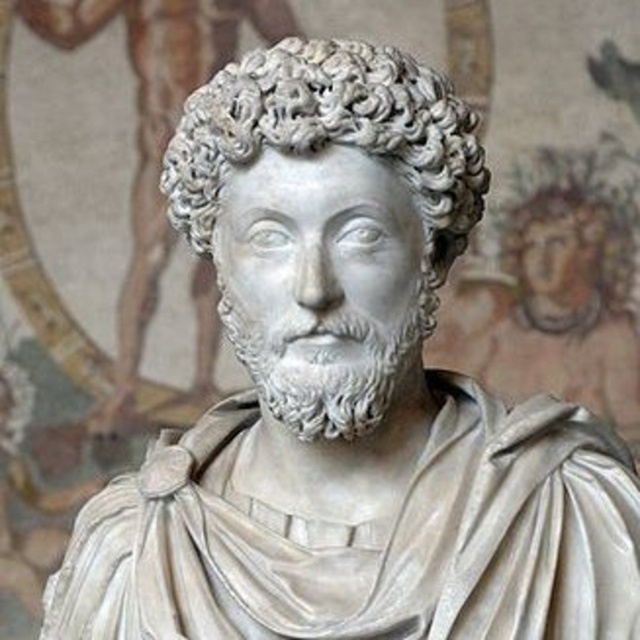
Between point (435, 211) and point (522, 307), which one is positioned behind?

Positioned behind is point (522, 307).

Between white marble head at center and white marble head at upper right, which one has less height?

white marble head at upper right

Between point (204, 209) and point (554, 193), which one is positioned in front?

Positioned in front is point (204, 209).

The width and height of the screenshot is (640, 640). Identify the location of white marble head at center. (332, 136).

At what (x,y) coordinates should I click in order to perform the action: click on white marble head at center. Please return your answer as a coordinate pair (x, y). Image resolution: width=640 pixels, height=640 pixels. Looking at the image, I should click on (332, 136).

The image size is (640, 640). In order to click on white marble head at center in this screenshot , I will do `click(332, 136)`.

Between white marble bust at center and white marble head at upper right, which one is positioned lower?

white marble head at upper right

Is point (147, 243) closer to viewer compared to point (532, 256)?

Yes, it is in front of point (532, 256).

Is point (205, 1) positioned after point (628, 244)?

That is True.

The height and width of the screenshot is (640, 640). Find the location of `white marble bust at center`. white marble bust at center is located at coordinates (154, 128).